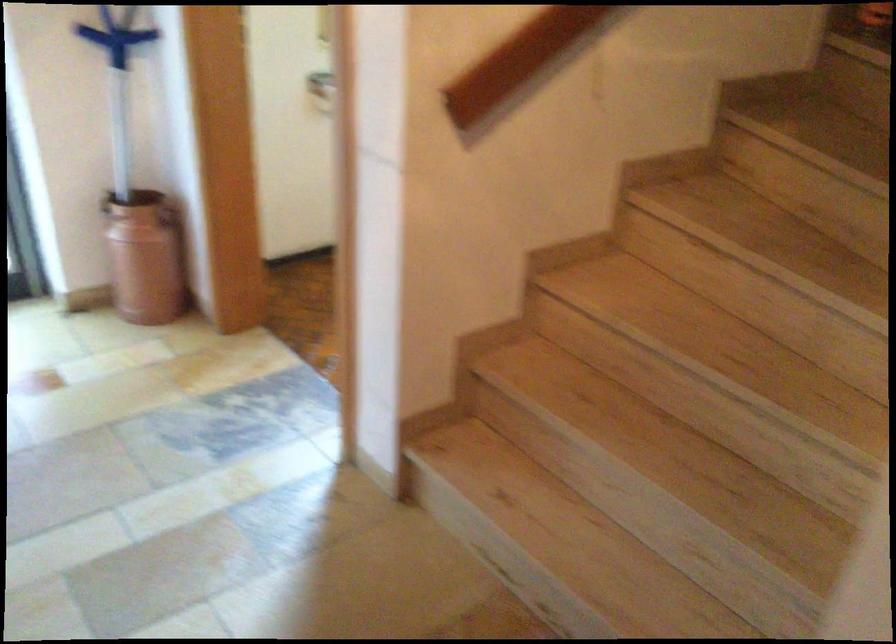
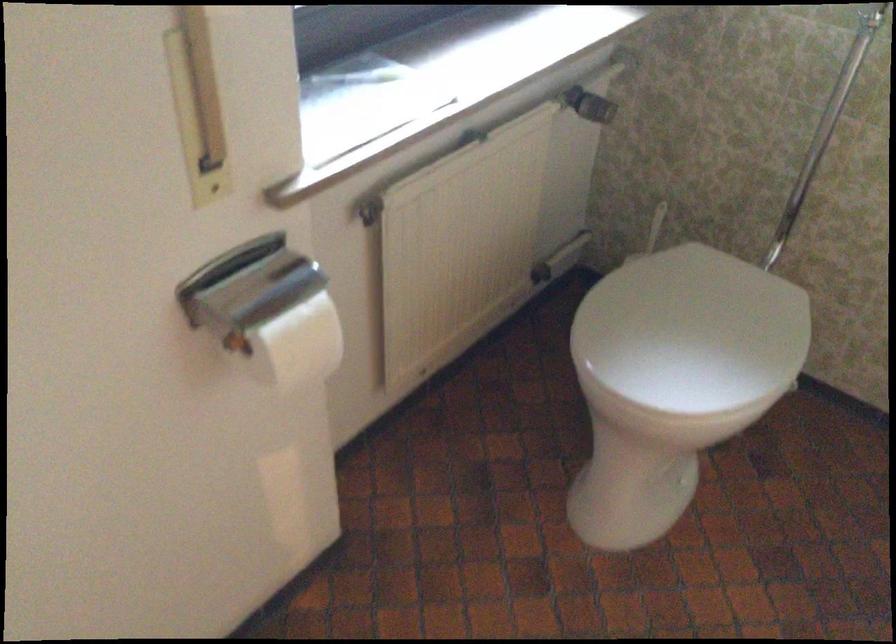
Question: In a continuous first-person perspective shot, in which direction is the camera moving?

Choices:
 (A) Left
 (B) Right
 (C) Forward
 (D) Backward

Answer: (C)